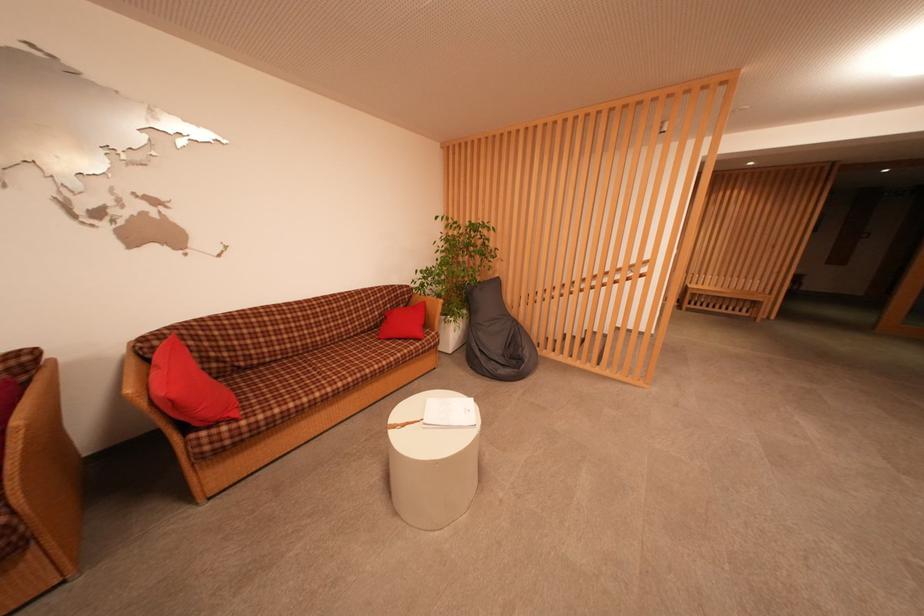
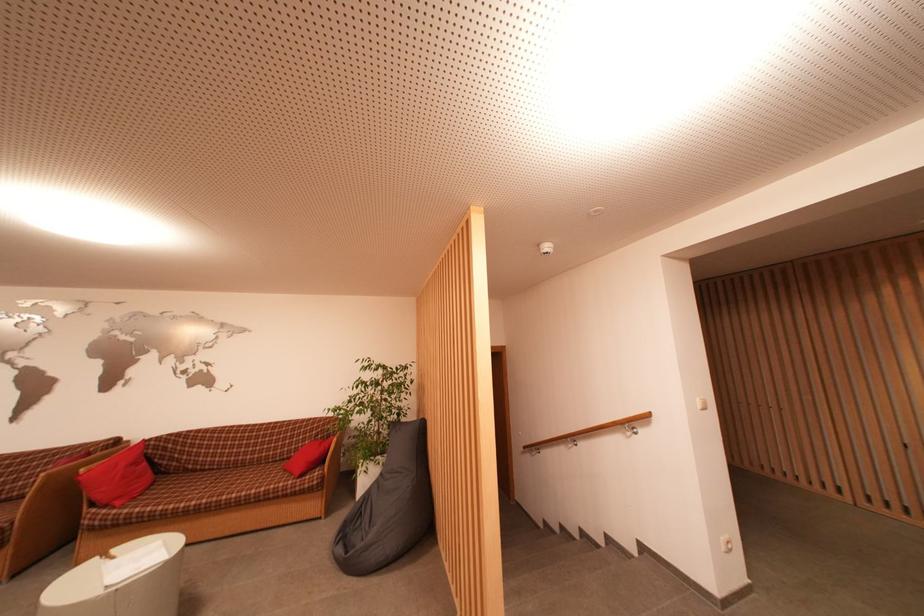
In the second image, find the point that corresponds to (402,307) in the first image.

(333, 439)